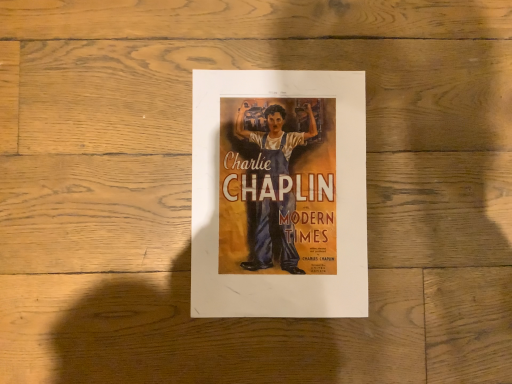
The image size is (512, 384). What are the coordinates of `vacant point above matte paper poster at center (from a real-world perspective)` in the screenshot? It's located at (279, 190).